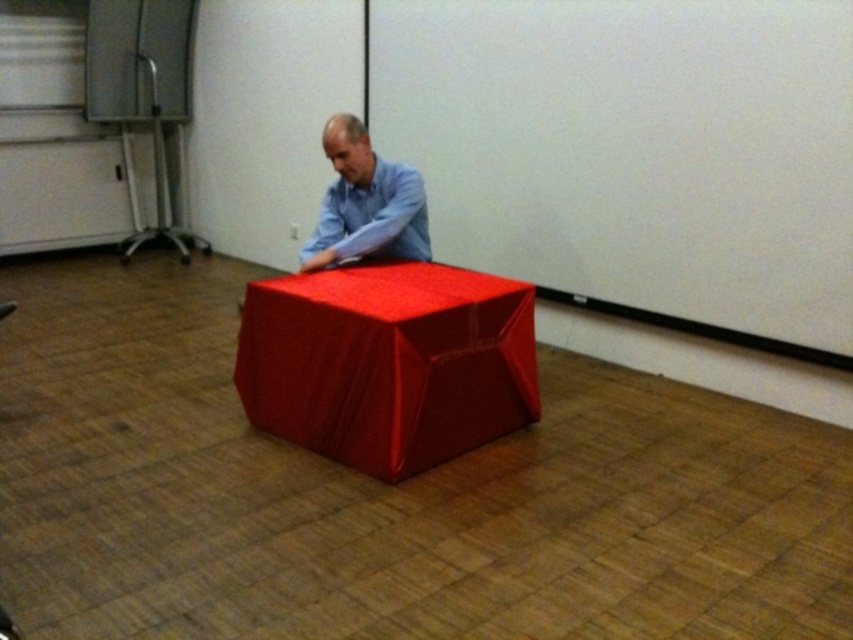
Question: Does shiny red cube at center appear on the left side of matte blue shirt at center?

Choices:
 (A) yes
 (B) no

Answer: (B)

Question: Which point is farther to the camera?

Choices:
 (A) (384, 448)
 (B) (402, 189)

Answer: (B)

Question: Can you confirm if shiny red cube at center is smaller than matte blue shirt at center?

Choices:
 (A) yes
 (B) no

Answer: (B)

Question: Which point is closer to the camera taking this photo?

Choices:
 (A) (424, 352)
 (B) (322, 211)

Answer: (A)

Question: Is the position of shiny red cube at center more distant than that of matte blue shirt at center?

Choices:
 (A) yes
 (B) no

Answer: (B)